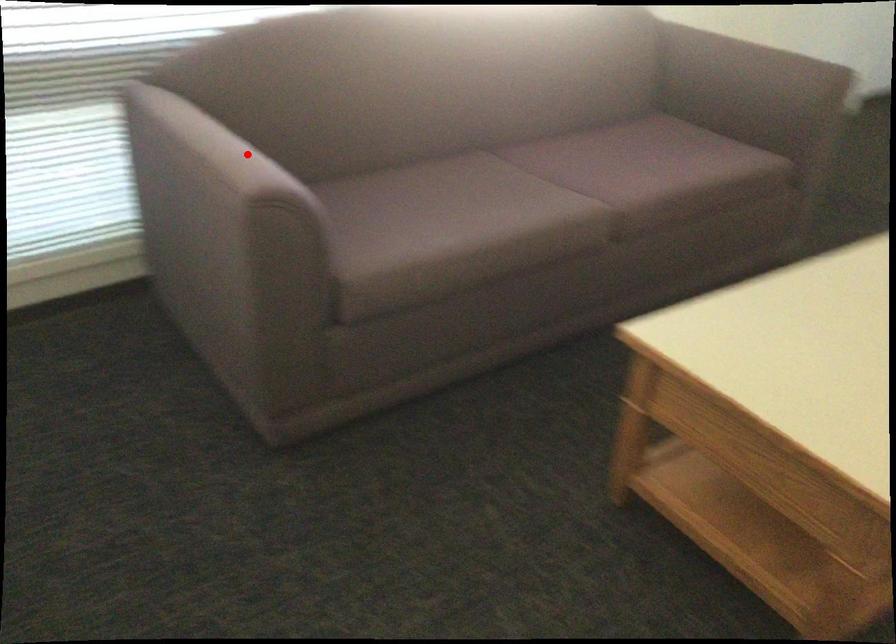
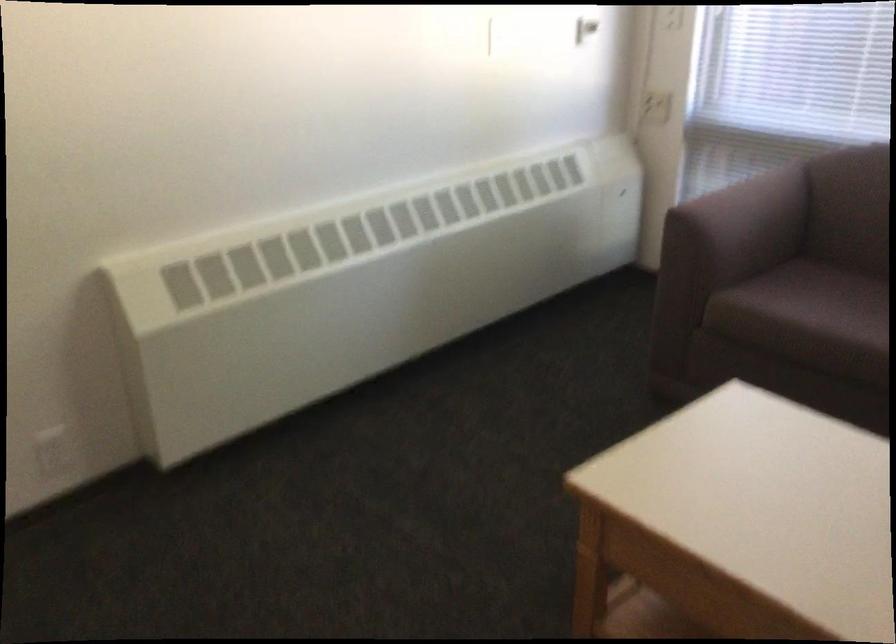
The point at the highlighted location is marked in the first image. Where is the corresponding point in the second image?

(752, 207)